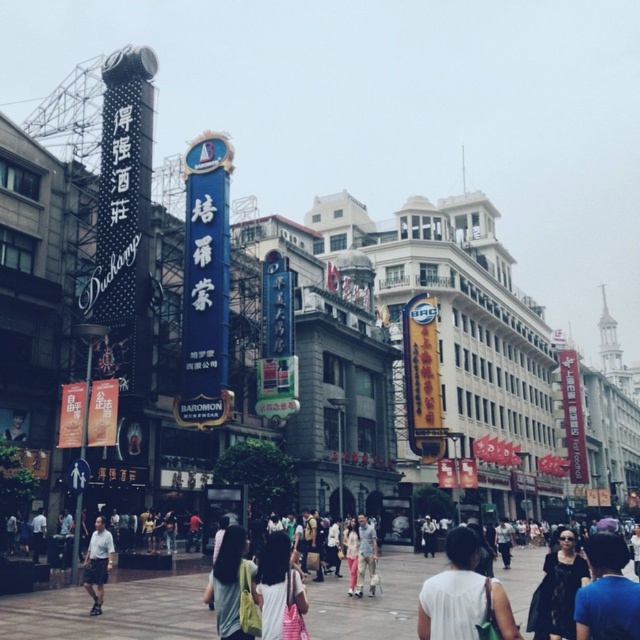
You are standing at the center of the street and notice a person wearing a dark blue shirt at lower right. Where is this person positioned relative to you?

The dark blue shirt at lower right is located at point (605, 589), which places it near the lower right corner of your field of view.

Please provide the 2D coordinates of the dark blue shirt at lower right in the image. The coordinates should be in the format of a point with two decimal places between 0 and 1, like 0.5 for the center of the image. The origin is at the bottom left corner of the image.

The 2D coordinates of the dark blue shirt at lower right are at point (605,589).

You are standing on the wet pavement observing the scene. There is a light brown fabric bag at center. Where exactly is the light brown fabric bag positioned in relation to the other elements in the scene?

The light brown fabric bag at center is located at coordinates point 0.920 on the x axis and 0.366 on the y axis.